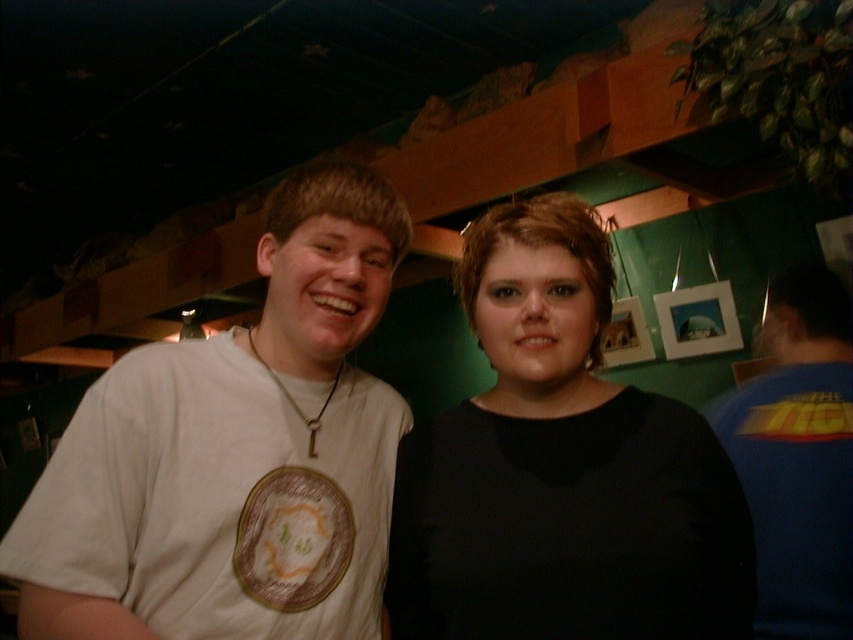
Is white cotton t-shirt at left taller than blue jersey at right?

No.

From the picture: Is white cotton t-shirt at left further to camera compared to blue jersey at right?

No, it is not.

Which is behind, point (181, 413) or point (831, 573)?

Positioned behind is point (831, 573).

Where is `white cotton t-shirt at left`? white cotton t-shirt at left is located at coordinates [x=234, y=454].

Where is `white cotton t-shirt at left`? This screenshot has height=640, width=853. white cotton t-shirt at left is located at coordinates (234, 454).

Identify the location of white cotton t-shirt at left. The height and width of the screenshot is (640, 853). point(234,454).

Between black matte shirt at center and blue jersey at right, which one appears on the right side from the viewer's perspective?

blue jersey at right

Between point (699, 636) and point (767, 300), which one is positioned behind?

Positioned behind is point (767, 300).

At what (x,y) coordinates should I click in order to perform the action: click on black matte shirt at center. Please return your answer as a coordinate pair (x, y). This screenshot has height=640, width=853. Looking at the image, I should click on (561, 468).